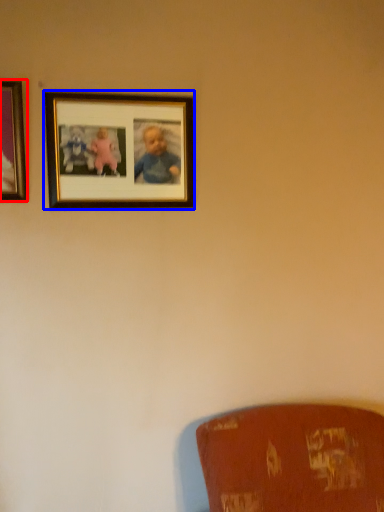
Question: Which object is closer to the camera taking this photo, picture frame (highlighted by a red box) or picture frame (highlighted by a blue box)?

Choices:
 (A) picture frame
 (B) picture frame

Answer: (A)